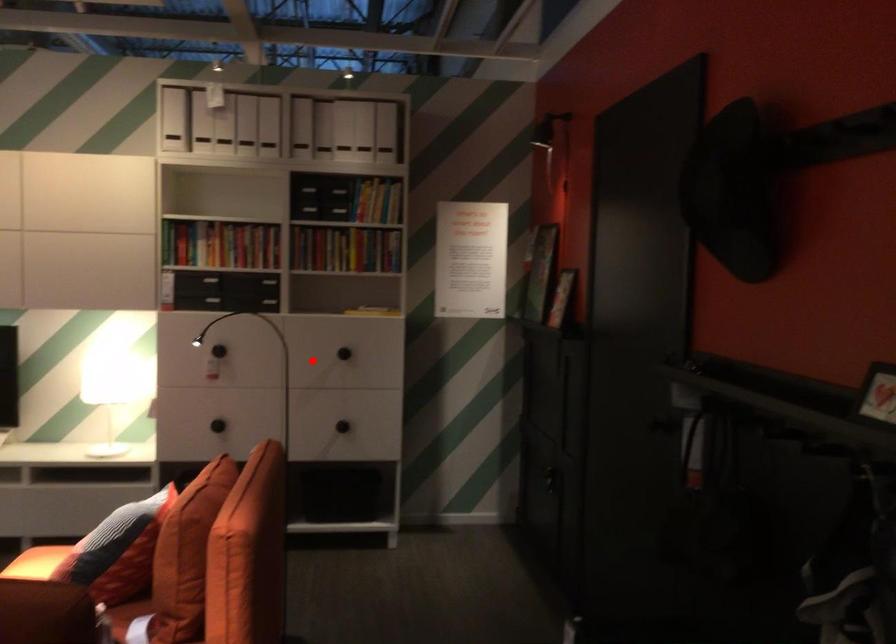
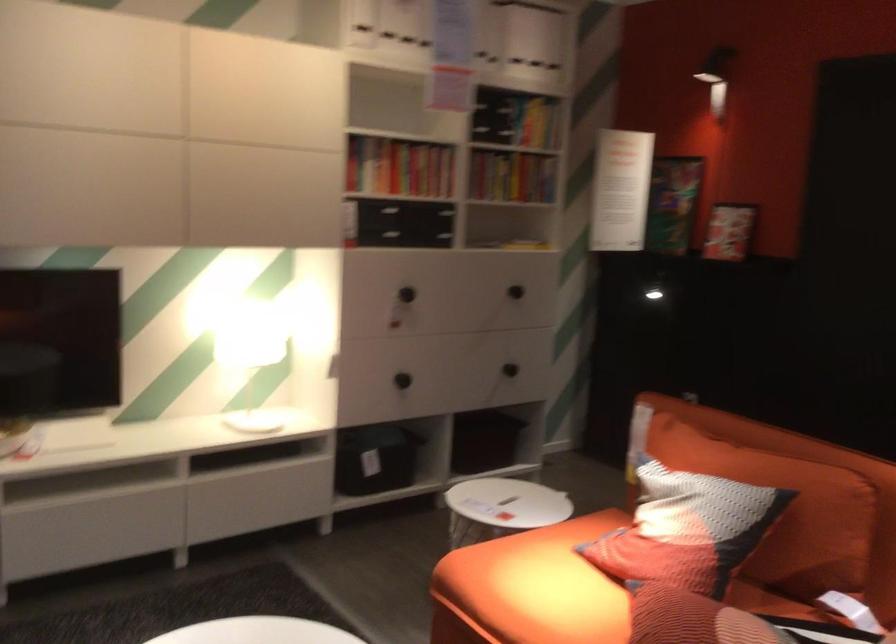
Question: I am providing you with two images of the same scene from different viewpoints. A red point is marked on the first image. Is the red point's position out of view in image 2?

Choices:
 (A) Yes
 (B) No

Answer: (B)